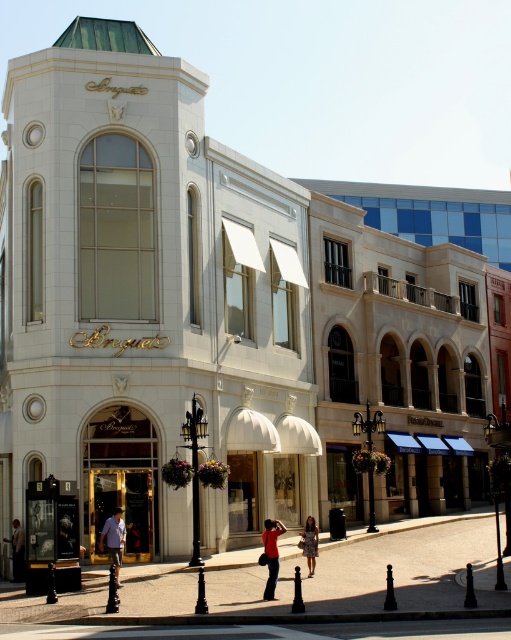
In the scene shown: Which of these two, light brown leather jacket at lower left or printed fabric dress at center, stands shorter?

Standing shorter between the two is light brown leather jacket at lower left.

What do you see at coordinates (16, 550) in the screenshot? I see `light brown leather jacket at lower left` at bounding box center [16, 550].

The width and height of the screenshot is (511, 640). I want to click on light brown leather jacket at lower left, so click(x=16, y=550).

Locate an element on the screen. The image size is (511, 640). light brown leather jacket at lower left is located at coordinates (16, 550).

Which of these two, light blue shirt at center or printed fabric dress at center, stands taller?

printed fabric dress at center is taller.

Based on the photo, is light blue shirt at center shorter than printed fabric dress at center?

Yes, light blue shirt at center is shorter than printed fabric dress at center.

Is point (118, 528) positioned after point (307, 538)?

No.

I want to click on light blue shirt at center, so click(113, 540).

The height and width of the screenshot is (640, 511). I want to click on light blue shirt at center, so click(113, 540).

Does point (109, 554) lie in front of point (17, 548)?

Yes, it is in front of point (17, 548).

Between point (117, 512) and point (15, 563), which one is positioned in front?

Positioned in front is point (117, 512).

Find the location of a particular element. Image resolution: width=511 pixels, height=640 pixels. light blue shirt at center is located at coordinates (113, 540).